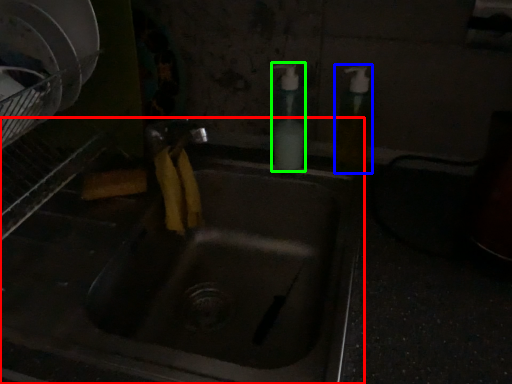
Question: Estimate the real-world distances between objects in this image. Which object is farther from sink (highlighted by a red box), soap dispenser (highlighted by a blue box) or soap dispenser (highlighted by a green box)?

Choices:
 (A) soap dispenser
 (B) soap dispenser

Answer: (A)